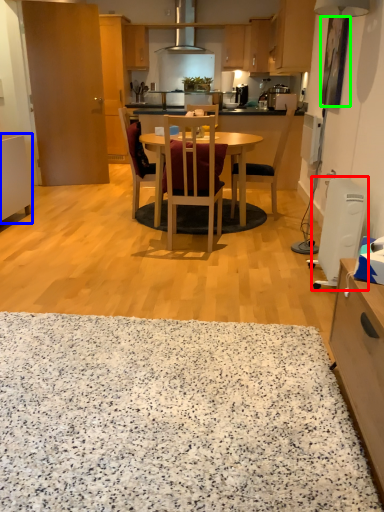
Question: Based on their relative distances, which object is nearer to appliance (highlighted by a red box)? Choose from cabinetry (highlighted by a blue box) and picture frame (highlighted by a green box).

Choices:
 (A) cabinetry
 (B) picture frame

Answer: (B)